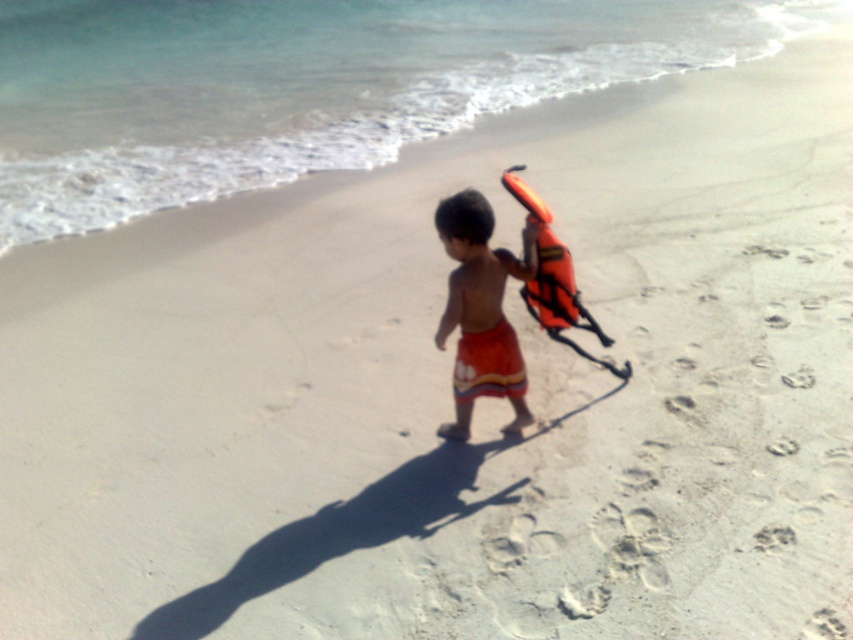
You are a lifeguard on duty and notice two orange fabric life vests on the beach. The orange fabric life vest at center and the orange fabric life jacket at right. You need to retrieve the one closer to the shoreline. Which one should you choose?

The orange fabric life vest at center is closer to the shoreline than the orange fabric life jacket at right, so you should retrieve the orange fabric life vest at center.

You are a lifeguard on duty and need to quickly grab a life vest for a swimmer in distress. You see the orange fabric life vest at center and the orange fabric life jacket at right. Which one is taller and should you choose if height is a priority?

The orange fabric life vest at center is much taller than the orange fabric life jacket at right, so you should choose the orange fabric life vest at center if height is a priority.

You are standing on the beach and see two points marked in the sand. The first point is at coordinate point[494,346] and the second is at point[509,259]. Which point is closer to you?

Point[494,346] is closer to you because it is further to the viewer than point[509,259].